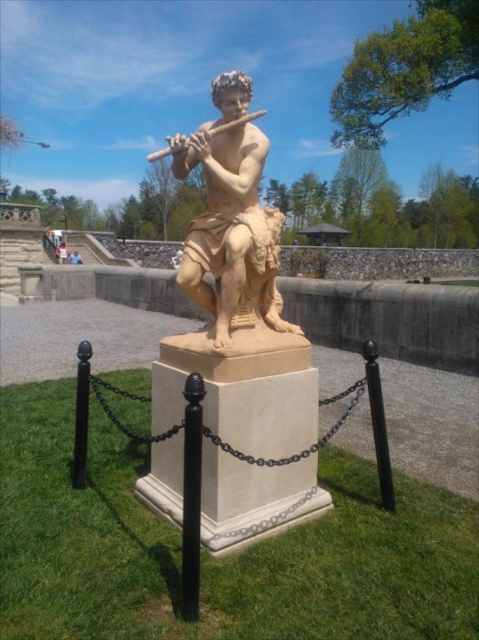
Question: Which point is farther to the camera?

Choices:
 (A) wooden flute at center
 (B) black polished metal pole at center right
 (C) black metal pole at lower left

Answer: (C)

Question: Which point is closer to the camera?

Choices:
 (A) wooden flute at center
 (B) black metal pole at center
 (C) black polished metal pole at center right

Answer: (B)

Question: Where is black polished metal pole at center right located in relation to black metal pole at lower left in the image?

Choices:
 (A) right
 (B) left

Answer: (A)

Question: Is black metal pole at center above wooden flute at center?

Choices:
 (A) no
 (B) yes

Answer: (A)

Question: Can you confirm if black metal pole at center is positioned to the right of black polished metal pole at center right?

Choices:
 (A) yes
 (B) no

Answer: (B)

Question: Which point is closer to the camera taking this photo?

Choices:
 (A) (168, 154)
 (B) (73, 472)
 (C) (243, 193)

Answer: (C)